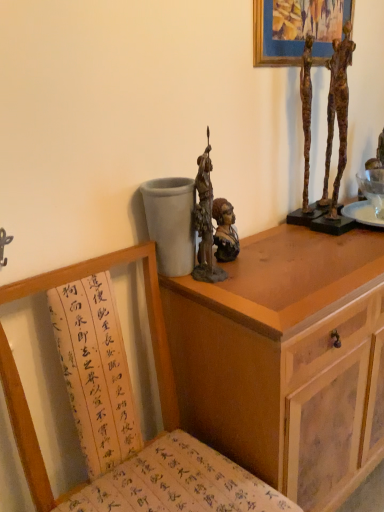
Image resolution: width=384 pixels, height=512 pixels. Identify the location of blank space above wooden cabinet at upper right (from a real-world perspective). click(x=308, y=249).